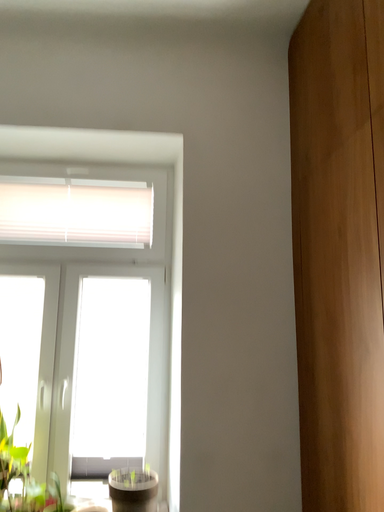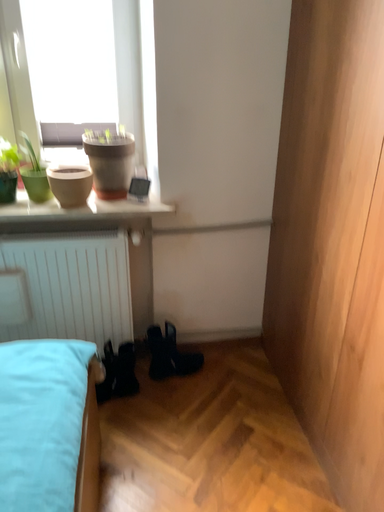
Question: How did the camera likely rotate when shooting the video?

Choices:
 (A) rotated downward
 (B) rotated upward

Answer: (A)